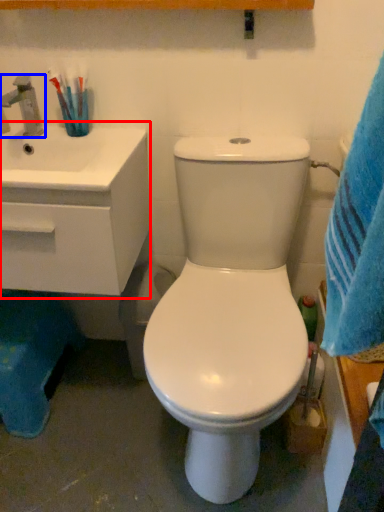
Question: Which of the following is the farthest to the observer, counter top (highlighted by a red box) or tap (highlighted by a blue box)?

Choices:
 (A) counter top
 (B) tap

Answer: (B)